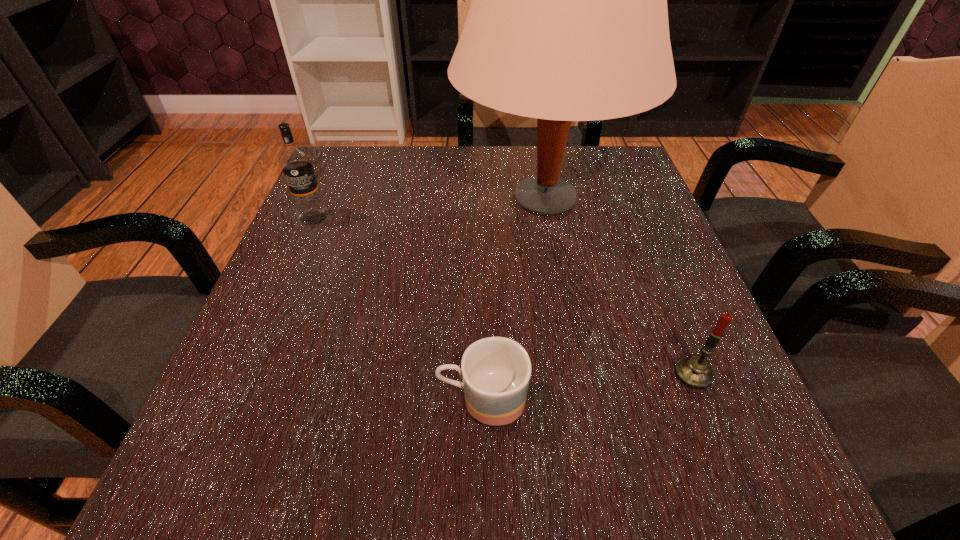
Find the location of a particular element. vacant point located 0.060m on the side with the handle of the mug is located at coordinates (396, 399).

Where is `vacant space situated on the side with the handle of the mug`? This screenshot has width=960, height=540. vacant space situated on the side with the handle of the mug is located at coordinates (228, 399).

Find the location of a particular element. vacant region located 0.120m on the side with the handle of the mug is located at coordinates (354, 399).

Identify the location of object that is positioned at the far edge. The width and height of the screenshot is (960, 540). (568, 22).

Identify the location of object that is at the left edge. (295, 162).

Locate an element on the screen. lampshade located in the right edge section of the desktop is located at coordinates (568, 22).

What are the coordinates of `candle that is at the right edge` in the screenshot? It's located at (694, 371).

Image resolution: width=960 pixels, height=540 pixels. I want to click on object situated at the far right corner, so click(568, 22).

Where is `blank area at the far edge`? Image resolution: width=960 pixels, height=540 pixels. blank area at the far edge is located at coordinates (496, 169).

In order to click on vacant area at the near edge of the desktop in this screenshot , I will do `click(636, 462)`.